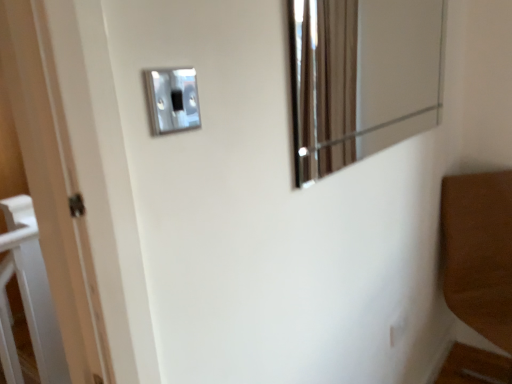
Question: Looking at their shapes, would you say metallic reflective mirror at upper right is wider or thinner than satin silver switch at upper center, the 2th light switch positioned from the back?

Choices:
 (A) wide
 (B) thin

Answer: (A)

Question: Is metallic reflective mirror at upper right taller or shorter than satin silver switch at upper center, the 2th light switch positioned from the back?

Choices:
 (A) tall
 (B) short

Answer: (A)

Question: Which object is positioned farthest from the metallic reflective mirror at upper right?

Choices:
 (A) satin silver switch at upper center, positioned as the first light switch in bottom-to-top order
 (B) satin silver switch at upper center, the first light switch positioned from the front

Answer: (B)

Question: Which object is positioned closest to the satin silver switch at upper center, the 1th light switch in the top-to-bottom sequence?

Choices:
 (A) satin silver switch at upper center, which is the 2th light switch from front to back
 (B) metallic reflective mirror at upper right

Answer: (A)